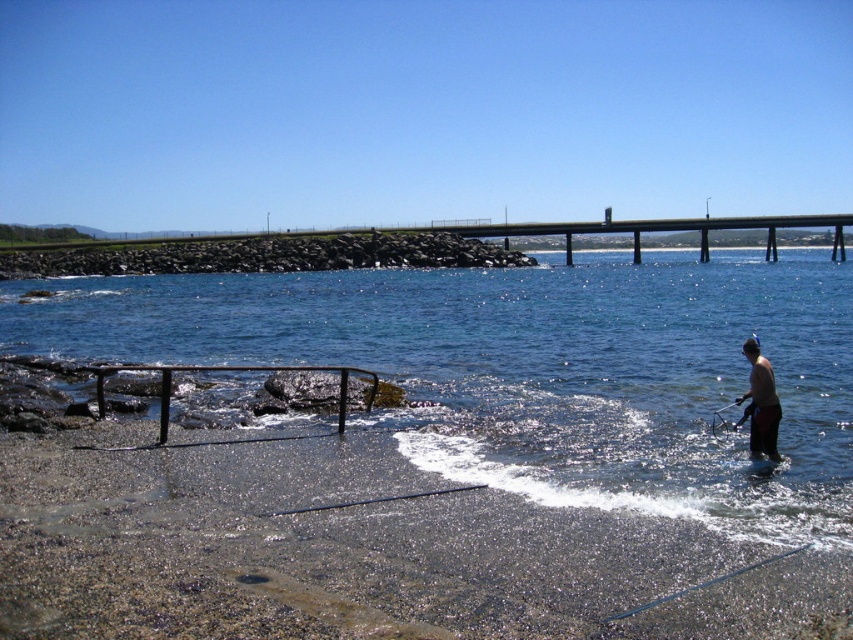
Question: Can you confirm if clear blue water at lower center is positioned to the left of skinny man at lower right?

Choices:
 (A) yes
 (B) no

Answer: (A)

Question: Which object is closer to the camera taking this photo?

Choices:
 (A) clear blue water at lower center
 (B) skinny man at lower right

Answer: (A)

Question: Is the position of clear blue water at lower center less distant than that of skinny man at lower right?

Choices:
 (A) yes
 (B) no

Answer: (A)

Question: Does clear blue water at lower center appear on the right side of skinny man at lower right?

Choices:
 (A) no
 (B) yes

Answer: (A)

Question: Which object is farther from the camera taking this photo?

Choices:
 (A) skinny man at lower right
 (B) clear blue water at lower center

Answer: (A)